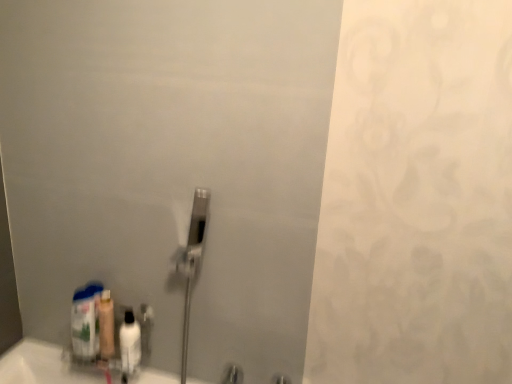
Question: Can you confirm if translucent plastic mouthwash at lower left, the second mouthwash positioned from the right, is taller than translucent plastic bottle at lower left?

Choices:
 (A) yes
 (B) no

Answer: (B)

Question: Can you confirm if translucent plastic mouthwash at lower left, the second mouthwash positioned from the right, is bigger than translucent plastic bottle at lower left?

Choices:
 (A) no
 (B) yes

Answer: (A)

Question: Can you confirm if translucent plastic mouthwash at lower left, the second mouthwash positioned from the right, is thinner than translucent plastic bottle at lower left?

Choices:
 (A) no
 (B) yes

Answer: (B)

Question: Considering the relative sizes of translucent plastic mouthwash at lower left, the second mouthwash positioned from the right, and translucent plastic bottle at lower left in the image provided, is translucent plastic mouthwash at lower left, the second mouthwash positioned from the right, wider than translucent plastic bottle at lower left?

Choices:
 (A) yes
 (B) no

Answer: (B)

Question: Can you confirm if translucent plastic mouthwash at lower left, the second mouthwash positioned from the right, is shorter than translucent plastic bottle at lower left?

Choices:
 (A) no
 (B) yes

Answer: (B)

Question: From a real-world perspective, is translucent plastic mouthwash at lower left, the second mouthwash positioned from the right, located beneath translucent plastic bottle at lower left?

Choices:
 (A) yes
 (B) no

Answer: (B)

Question: Considering the relative sizes of translucent plastic bottle at lower left and white glossy bottle at lower left, which is the first mouthwash from right to left, in the image provided, is translucent plastic bottle at lower left shorter than white glossy bottle at lower left, which is the first mouthwash from right to left,?

Choices:
 (A) no
 (B) yes

Answer: (A)

Question: Is translucent plastic bottle at lower left located outside white glossy bottle at lower left, the 2th mouthwash in the left-to-right sequence?

Choices:
 (A) no
 (B) yes

Answer: (B)

Question: Does translucent plastic bottle at lower left lie behind white glossy bottle at lower left, the 2th mouthwash in the left-to-right sequence?

Choices:
 (A) yes
 (B) no

Answer: (A)

Question: From the image's perspective, is translucent plastic bottle at lower left on white glossy bottle at lower left, the 2th mouthwash in the left-to-right sequence?

Choices:
 (A) yes
 (B) no

Answer: (A)

Question: Considering the relative positions of translucent plastic bottle at lower left and white glossy bottle at lower left, which is the first mouthwash from right to left, in the image provided, is translucent plastic bottle at lower left to the right of white glossy bottle at lower left, which is the first mouthwash from right to left, from the viewer's perspective?

Choices:
 (A) yes
 (B) no

Answer: (B)

Question: Is translucent plastic bottle at lower left positioned far away from white glossy bottle at lower left, which is the first mouthwash from right to left?

Choices:
 (A) yes
 (B) no

Answer: (B)

Question: Would you say white glossy bottle at lower left, which is the first mouthwash from right to left, contains translucent plastic bottle at lower left?

Choices:
 (A) no
 (B) yes

Answer: (A)